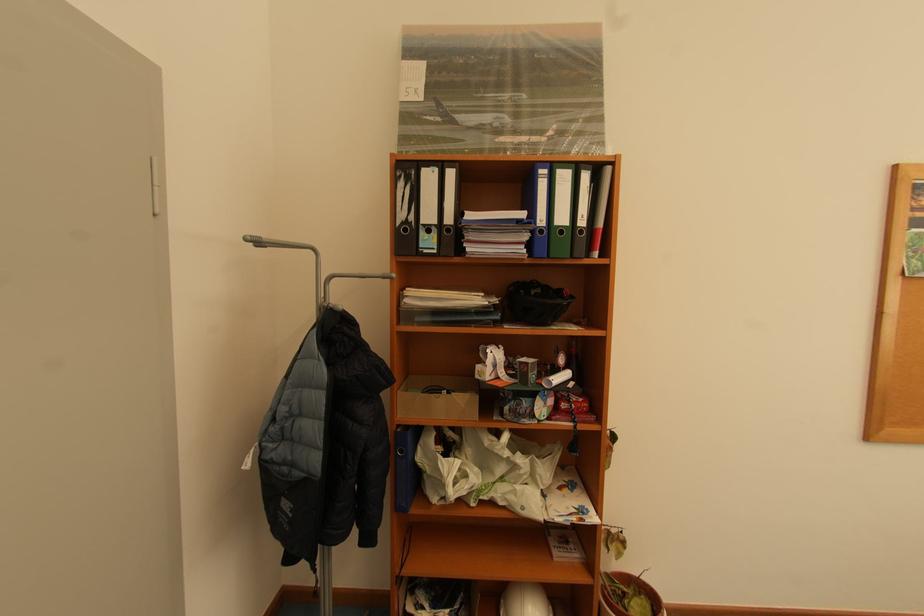
The location [898,317] corresponds to which object?

It corresponds to the wrapped picture frame in the image.